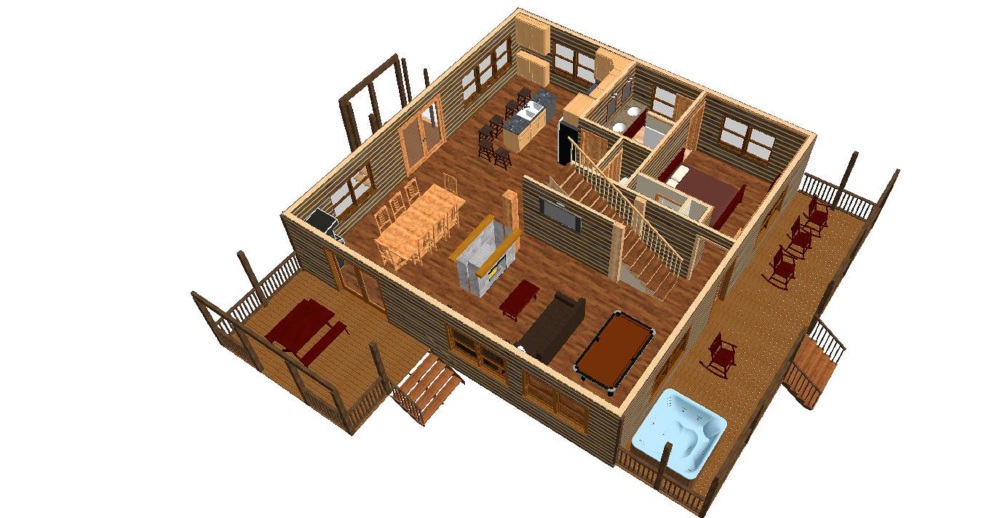
At what (x,y) coordinates should I click in order to perform the action: click on rocking chairs. Please return your answer as a coordinate pair (x, y). The width and height of the screenshot is (1000, 518). Looking at the image, I should click on (815, 221), (801, 233), (781, 265), (722, 359).